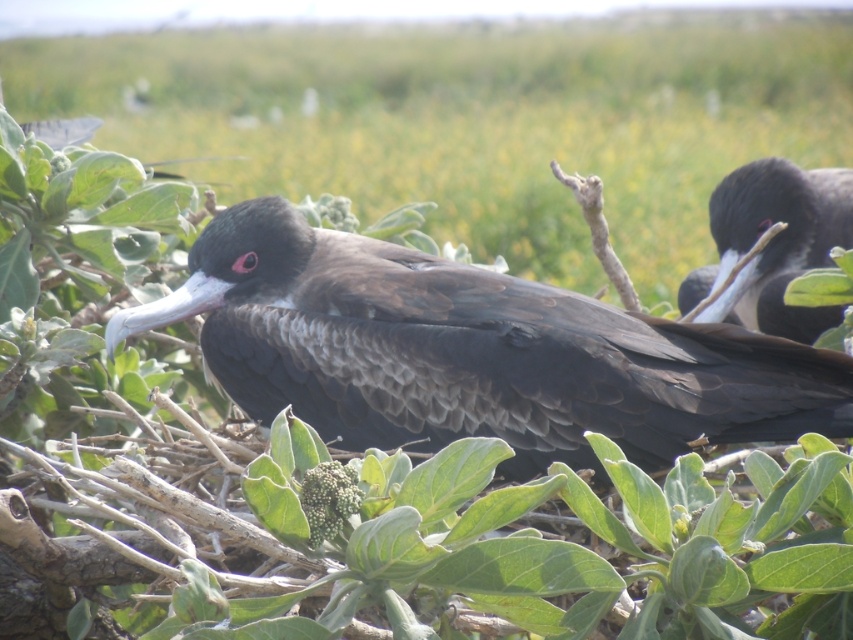
Is matte black bird at center taller than shiny black bird at upper right?

Yes.

How far apart are matte black bird at center and shiny black bird at upper right?

A distance of 32.68 inches exists between matte black bird at center and shiny black bird at upper right.

The image size is (853, 640). I want to click on matte black bird at center, so click(473, 353).